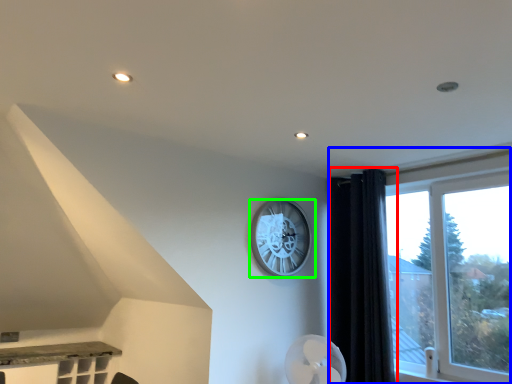
Question: Based on their relative distances, which object is nearer to curtain (highlighted by a red box)? Choose from window (highlighted by a blue box) and wall clock (highlighted by a green box).

Choices:
 (A) window
 (B) wall clock

Answer: (A)